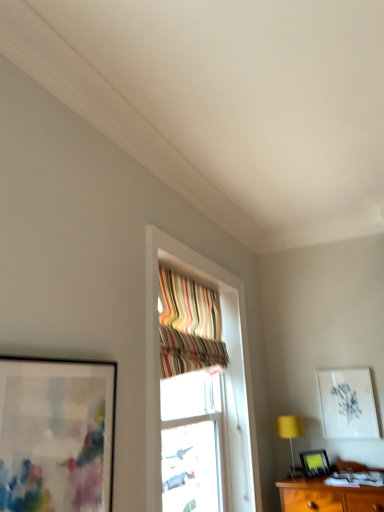
Question: Are striped fabric curtain at upper center and white paper at upper right, which is counted as the 2th picture frame, starting from the bottom, far apart?

Choices:
 (A) yes
 (B) no

Answer: (A)

Question: Does striped fabric curtain at upper center have a smaller size compared to white paper at upper right, the first picture frame when ordered from back to front?

Choices:
 (A) yes
 (B) no

Answer: (B)

Question: Are striped fabric curtain at upper center and white paper at upper right, placed as the 3th picture frame when sorted from left to right, beside each other?

Choices:
 (A) no
 (B) yes

Answer: (A)

Question: Is striped fabric curtain at upper center to the right of white paper at upper right, the first picture frame when ordered from back to front, from the viewer's perspective?

Choices:
 (A) yes
 (B) no

Answer: (B)

Question: Could you tell me if striped fabric curtain at upper center is turned towards white paper at upper right, which is counted as the 2th picture frame, starting from the bottom?

Choices:
 (A) no
 (B) yes

Answer: (A)

Question: Visually, is yellow fabric table lamp at lower right positioned to the left or to the right of white paper at upper right, placed as the 3th picture frame when sorted from left to right?

Choices:
 (A) left
 (B) right

Answer: (A)

Question: Is yellow fabric table lamp at lower right in front of or behind white paper at upper right, which is counted as the 2th picture frame, starting from the bottom, in the image?

Choices:
 (A) behind
 (B) front

Answer: (B)

Question: Considering the positions of yellow fabric table lamp at lower right and white paper at upper right, placed as the 3th picture frame when sorted from left to right, in the image, is yellow fabric table lamp at lower right wider or thinner than white paper at upper right, placed as the 3th picture frame when sorted from left to right,?

Choices:
 (A) wide
 (B) thin

Answer: (A)

Question: Is yellow fabric table lamp at lower right inside or outside of white paper at upper right, which appears as the second picture frame when viewed from the top?

Choices:
 (A) inside
 (B) outside

Answer: (B)

Question: Do you think striped fabric curtain at upper center is within matte black picture frame at left, the first picture frame when ordered from front to back, or outside of it?

Choices:
 (A) outside
 (B) inside

Answer: (A)

Question: In terms of width, does striped fabric curtain at upper center look wider or thinner when compared to matte black picture frame at left, the 3th picture frame viewed from the right?

Choices:
 (A) wide
 (B) thin

Answer: (A)

Question: Visually, is striped fabric curtain at upper center positioned to the left or to the right of matte black picture frame at left, acting as the third picture frame starting from the bottom?

Choices:
 (A) left
 (B) right

Answer: (B)

Question: From their relative heights in the image, would you say striped fabric curtain at upper center is taller or shorter than matte black picture frame at left, arranged as the third picture frame when viewed from the back?

Choices:
 (A) tall
 (B) short

Answer: (A)

Question: Based on their sizes in the image, would you say white paper at upper right, the first picture frame when ordered from back to front, is bigger or smaller than matte black picture frame at left, marked as the first picture frame in a top-to-bottom arrangement?

Choices:
 (A) big
 (B) small

Answer: (B)

Question: Relative to matte black picture frame at left, the 3th picture frame viewed from the right, is white paper at upper right, placed as the 3th picture frame when sorted from left to right, in front or behind?

Choices:
 (A) behind
 (B) front

Answer: (A)